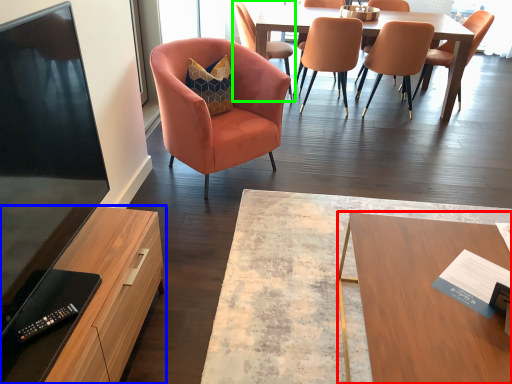
Question: Which object is the farthest from desk (highlighted by a red box)? Choose among these: cabinetry (highlighted by a blue box) or chair (highlighted by a green box).

Choices:
 (A) cabinetry
 (B) chair

Answer: (B)